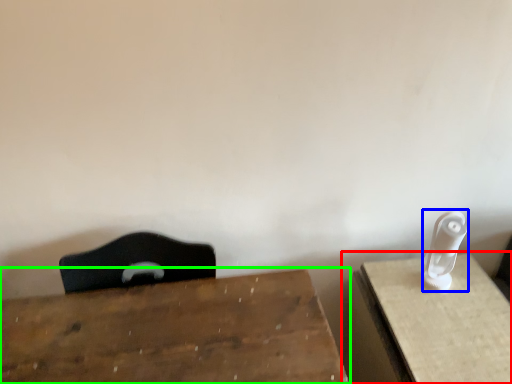
Question: Which object is the closest to the table (highlighted by a red box)? Choose among these: Wii controller (highlighted by a blue box) or table (highlighted by a green box).

Choices:
 (A) Wii controller
 (B) table

Answer: (A)